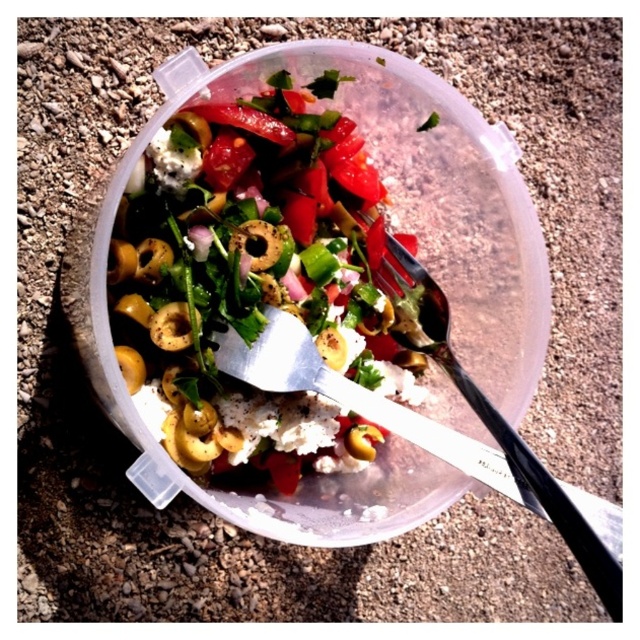
Question: Can you confirm if shiny plastic salad bowl at center is bigger than metallic silver fork at center?

Choices:
 (A) no
 (B) yes

Answer: (B)

Question: Does shiny plastic salad bowl at center have a greater width compared to metallic silver fork at center?

Choices:
 (A) yes
 (B) no

Answer: (A)

Question: Observing the image, what is the correct spatial positioning of shiny plastic salad bowl at center in reference to metallic silver fork at center?

Choices:
 (A) below
 (B) above

Answer: (B)

Question: Which point is farther to the camera?

Choices:
 (A) metallic silver fork at center
 (B) shiny plastic salad bowl at center

Answer: (B)